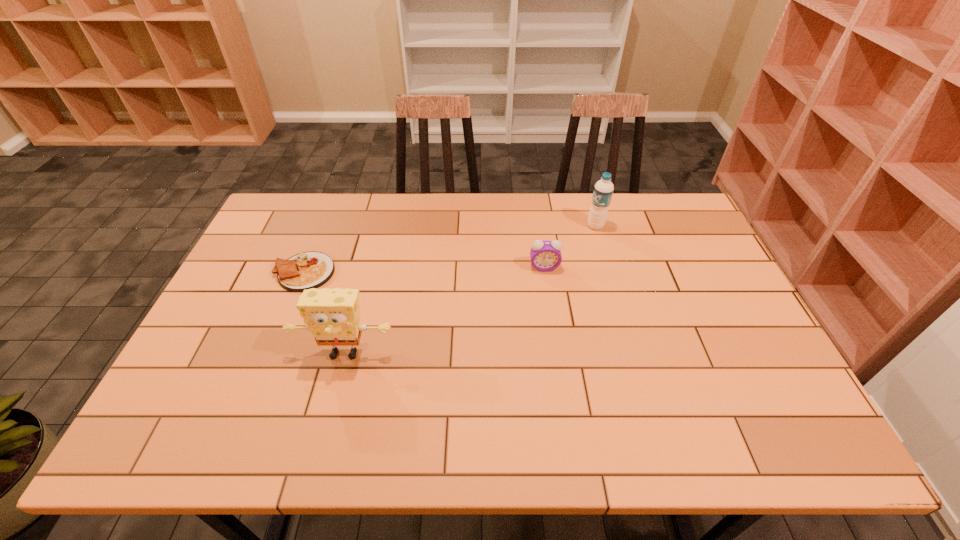
Where is `empty space between the third object from left to right and the rightmost object`? empty space between the third object from left to right and the rightmost object is located at coordinates (570, 247).

Identify the location of vacant area that lies between the nearest object and the rightmost object. This screenshot has height=540, width=960. (469, 289).

The width and height of the screenshot is (960, 540). What are the coordinates of `empty space that is in between the second object from right to left and the rightmost object` in the screenshot? It's located at (570, 247).

Where is `empty space between the nearest object and the water bottle`? The image size is (960, 540). empty space between the nearest object and the water bottle is located at coordinates (469, 289).

Find the location of `vacant point located between the water bottle and the nearest object`. vacant point located between the water bottle and the nearest object is located at coordinates (469, 289).

Where is `object that can be found as the third closest to the nearest object`? The image size is (960, 540). object that can be found as the third closest to the nearest object is located at coordinates (603, 190).

Identify the location of the closest object to the sponge. (306, 270).

Identify the location of blank space that satisfies the following two spatial constraints: 1. on the label of the farthest object; 2. on the front side of the shortest object. This screenshot has height=540, width=960. (610, 272).

You are a GUI agent. You are given a task and a screenshot of the screen. Output one action in this format:
    pyautogui.click(x=<x>, y=<y>)
    Task: Click on the free region that satisfies the following two spatial constraints: 1. on the label of the farthest object; 2. on the face of the second shortest object
    
    Given the screenshot: What is the action you would take?
    pyautogui.click(x=608, y=267)